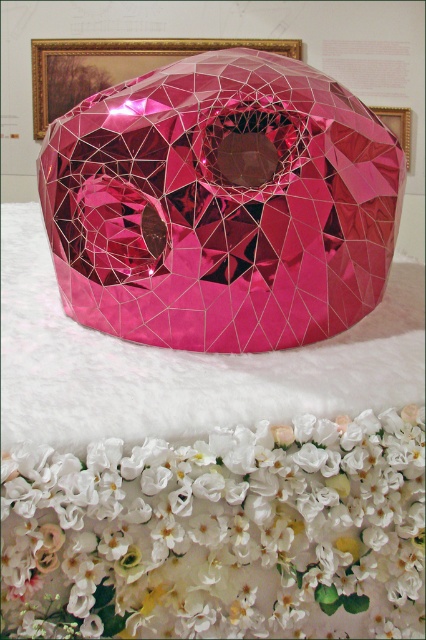
Question: Does shiny pink crystal at center have a greater width compared to white silk flowers at center?

Choices:
 (A) no
 (B) yes

Answer: (B)

Question: Which point appears farthest from the camera in this image?

Choices:
 (A) (281, 195)
 (B) (409, 570)

Answer: (A)

Question: Among these objects, which one is farthest from the camera?

Choices:
 (A) white silk flowers at center
 (B) shiny pink crystal at center

Answer: (B)

Question: Does shiny pink crystal at center appear over white silk flowers at center?

Choices:
 (A) no
 (B) yes

Answer: (B)

Question: Is shiny pink crystal at center above white silk flowers at center?

Choices:
 (A) yes
 (B) no

Answer: (A)